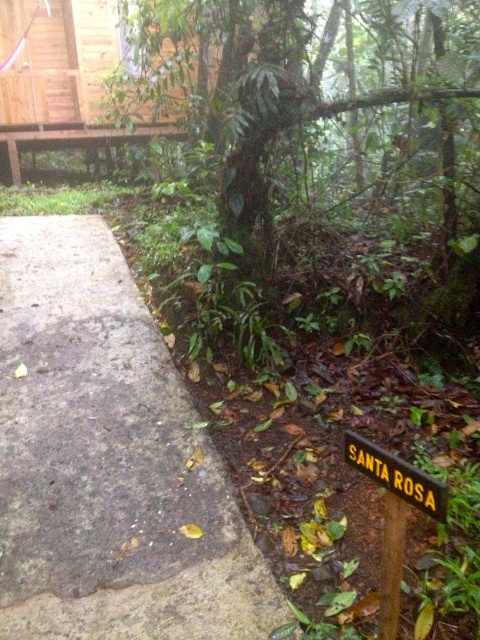
You are standing at the point marked as point (x=56, y=348) in the image. The paved pathway on the left is 1.2 meters wide. Can you step onto the pathway without moving more than 1 meter from your current position?

The distance between you and the viewer is 3.31 meters, so stepping onto the pathway would require moving more than 1 meter from your current position.

A hiker is standing at the point marked as point (x=101, y=525). They need to reach a water source located 2.18 meters away from their current position. Based on the scene description, which direction should they move to find the water source?

The water source is located 2.18 meters away from point (x=101, y=525). Since the pathway is on the left side of the frame and the lush vegetation with fallen leaves is to the right, the hiker should move towards the pathway on the left to reach the water source.